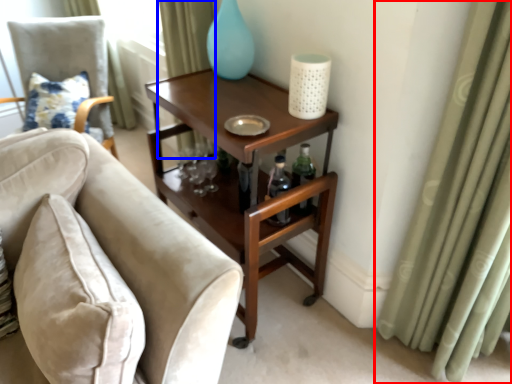
Question: Which of the following is the closest to the observer, curtain (highlighted by a red box) or curtain (highlighted by a blue box)?

Choices:
 (A) curtain
 (B) curtain

Answer: (A)